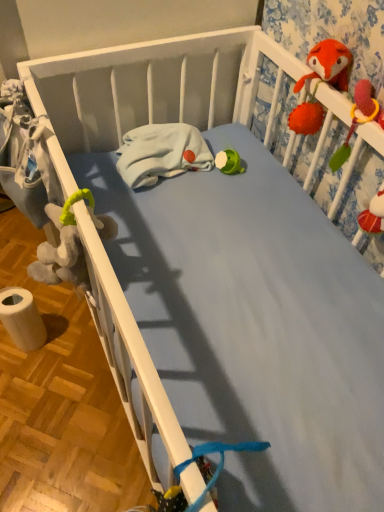
The image size is (384, 512). I want to click on vacant space behind white paper towel at lower left, so click(49, 303).